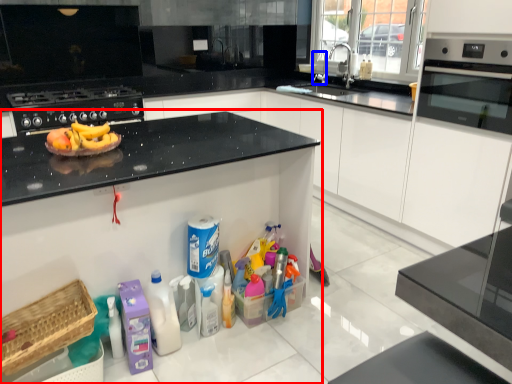
Question: Which of the following is the farthest to the observer, countertop (highlighted by a red box) or faucet (highlighted by a blue box)?

Choices:
 (A) countertop
 (B) faucet

Answer: (B)